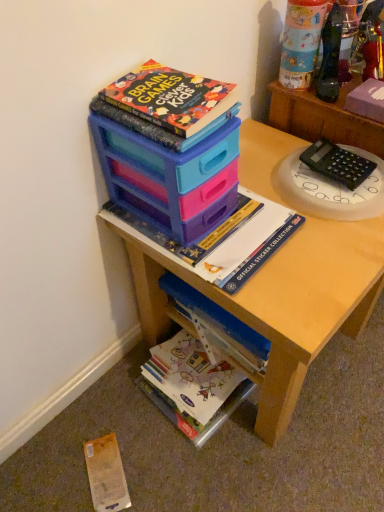
Question: Is black plastic calculator at upper right in front of white glossy book at lower center, which is the 1th book from bottom to top?

Choices:
 (A) yes
 (B) no

Answer: (A)

Question: Does black plastic calculator at upper right have a larger size compared to white glossy book at lower center, the 3th book in the top-to-bottom sequence?

Choices:
 (A) no
 (B) yes

Answer: (A)

Question: Considering the relative positions of black plastic calculator at upper right and white glossy book at lower center, which is the 1th book from bottom to top, in the image provided, is black plastic calculator at upper right to the left of white glossy book at lower center, which is the 1th book from bottom to top, from the viewer's perspective?

Choices:
 (A) yes
 (B) no

Answer: (B)

Question: Is white glossy book at lower center, the 3th book in the top-to-bottom sequence, at the back of black plastic calculator at upper right?

Choices:
 (A) no
 (B) yes

Answer: (A)

Question: Is black plastic calculator at upper right positioned behind white glossy book at lower center, which is the 1th book from bottom to top?

Choices:
 (A) no
 (B) yes

Answer: (A)

Question: Looking at their shapes, would you say matte plastic storage box at upper center is wider or thinner than black plastic calculator at upper right?

Choices:
 (A) wide
 (B) thin

Answer: (A)

Question: Does point (201, 209) appear closer or farther from the camera than point (352, 155)?

Choices:
 (A) farther
 (B) closer

Answer: (B)

Question: From the image's perspective, is matte plastic storage box at upper center located above or below black plastic calculator at upper right?

Choices:
 (A) above
 (B) below

Answer: (B)

Question: Looking at the image, does matte plastic storage box at upper center seem bigger or smaller compared to black plastic calculator at upper right?

Choices:
 (A) small
 (B) big

Answer: (B)

Question: Is matte plastic storage at upper center, the 2th book in the bottom-to-top sequence, wider or thinner than black plastic calculator at upper right?

Choices:
 (A) wide
 (B) thin

Answer: (A)

Question: Which is correct: matte plastic storage at upper center, the 2th book in the bottom-to-top sequence, is inside black plastic calculator at upper right, or outside of it?

Choices:
 (A) outside
 (B) inside

Answer: (A)

Question: Considering their positions, is matte plastic storage at upper center, the 2th book in the bottom-to-top sequence, located in front of or behind black plastic calculator at upper right?

Choices:
 (A) behind
 (B) front

Answer: (B)

Question: From the image's perspective, is matte plastic storage at upper center, the 2th book in the bottom-to-top sequence, positioned above or below black plastic calculator at upper right?

Choices:
 (A) below
 (B) above

Answer: (A)

Question: In the image, is white glossy book at lower center, which is the 1th book from bottom to top, on the left side or the right side of hardcover book at upper center, the 3th book when ordered from bottom to top?

Choices:
 (A) right
 (B) left

Answer: (A)

Question: Considering the positions of white glossy book at lower center, which is the 1th book from bottom to top, and hardcover book at upper center, which is counted as the 1th book, starting from the top, in the image, is white glossy book at lower center, which is the 1th book from bottom to top, wider or thinner than hardcover book at upper center, which is counted as the 1th book, starting from the top,?

Choices:
 (A) thin
 (B) wide

Answer: (B)